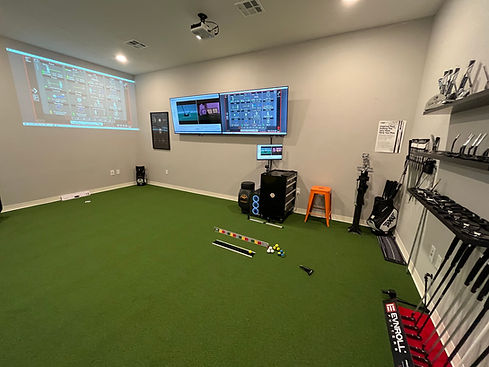
At what (x,y) coordinates should I click in order to perform the action: click on cabinet drawer. Please return your answer as a coordinate pair (x, y). This screenshot has width=489, height=367. Looking at the image, I should click on (286, 186).